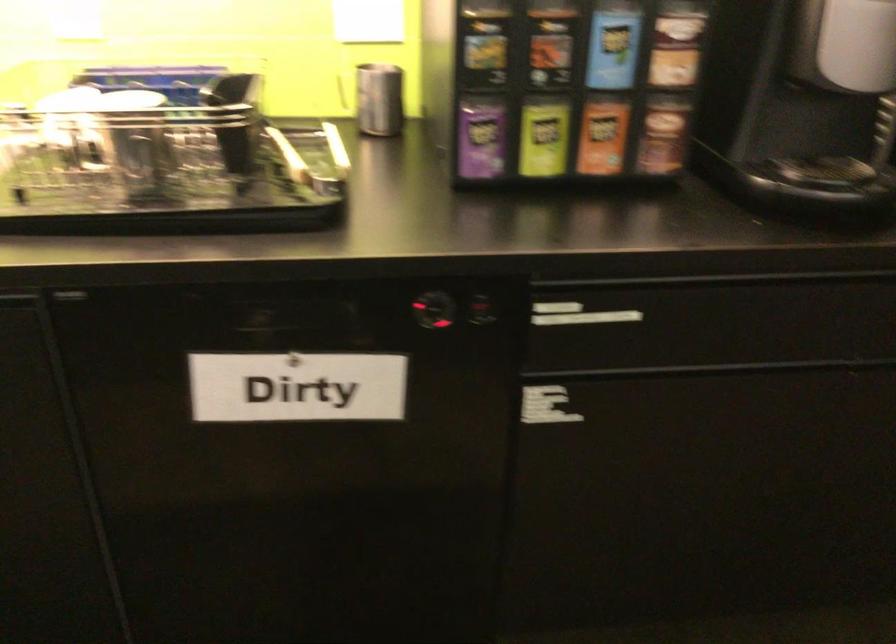
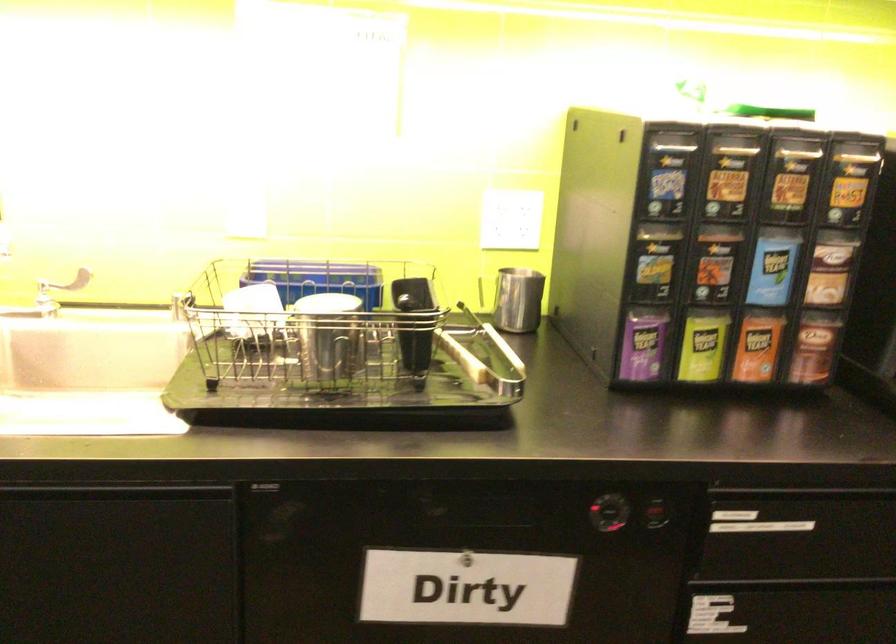
Question: What movement of the cameraman would produce the second image?

Choices:
 (A) Left
 (B) Right
 (C) Forward
 (D) Backward

Answer: (A)